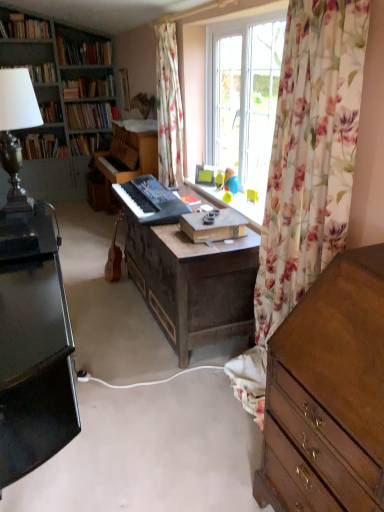
Describe the element at coordinates (328, 394) in the screenshot. The width and height of the screenshot is (384, 512). I see `wooden chest of drawers at right` at that location.

What is the approximate width of hardcover books at upper left, the 1th book viewed from the top?

The width of hardcover books at upper left, the 1th book viewed from the top, is 12.71 inches.

The image size is (384, 512). Identify the location of hardcover books at upper left, which appears as the fifth book when ordered from the bottom. (89, 87).

Find the location of a particular element. The image size is (384, 512). brown wooden guitar at center is located at coordinates point(114,256).

The height and width of the screenshot is (512, 384). In order to click on wooden chest of drawers at right in this screenshot , I will do `click(328, 394)`.

Is floral fabric curtain at center, the 1th curtain in the back-to-front sequence, behind black matte keyboard at center?

Yes, floral fabric curtain at center, the 1th curtain in the back-to-front sequence, is further from the viewer.

Which object is positioned more to the right, floral fabric curtain at center, the 1th curtain in the back-to-front sequence, or black matte keyboard at center?

From the viewer's perspective, floral fabric curtain at center, the 1th curtain in the back-to-front sequence, appears more on the right side.

From the picture: From the image's perspective, which object appears higher, floral fabric curtain at center, the 1th curtain in the back-to-front sequence, or black matte keyboard at center?

floral fabric curtain at center, the 1th curtain in the back-to-front sequence.

Considering the relative positions of hardcover books at upper left, arranged as the third book when viewed from the top, and metallic silver lampshade at upper left in the image provided, is hardcover books at upper left, arranged as the third book when viewed from the top, to the right of metallic silver lampshade at upper left from the viewer's perspective?

Incorrect, hardcover books at upper left, arranged as the third book when viewed from the top, is not on the right side of metallic silver lampshade at upper left.

Identify the location of the 5th book above when counting from the metallic silver lampshade at upper left (from the image's perspective). (89, 87).

Who is shorter, hardcover books at upper left, which appears as the fifth book when ordered from the bottom, or metallic silver lampshade at upper left?

hardcover books at upper left, which appears as the fifth book when ordered from the bottom.

Between hardcover book at left, arranged as the first book when ordered from the bottom, and hardcover books at upper left, arranged as the third book when viewed from the top, which one has less height?

hardcover books at upper left, arranged as the third book when viewed from the top.

Is hardcover book at left, arranged as the first book when ordered from the bottom, positioned beyond the bounds of hardcover books at upper left, which appears as the fifth book when ordered from the bottom?

That's correct, hardcover book at left, arranged as the first book when ordered from the bottom, is outside of hardcover books at upper left, which appears as the fifth book when ordered from the bottom.

From a real-world perspective, count 3rd books upward from the hardcover book at left, placed as the 7th book when sorted from top to bottom, and point to it. Please provide its 2D coordinates.

[(89, 87)]

Is the surface of hardcover book at left, placed as the 7th book when sorted from top to bottom, in direct contact with hardcover books at upper left, arranged as the third book when viewed from the top?

hardcover book at left, placed as the 7th book when sorted from top to bottom, and hardcover books at upper left, arranged as the third book when viewed from the top, are clearly separated.

Could you tell me if wooden desk at center is turned towards hardcover books at upper left, which ranks as the 2th book in top-to-bottom order?

No, wooden desk at center is not facing towards hardcover books at upper left, which ranks as the 2th book in top-to-bottom order.

Can you see wooden desk at center touching hardcover books at upper left, which ranks as the 2th book in top-to-bottom order?

No.

From a real-world perspective, between wooden desk at center and hardcover books at upper left, acting as the sixth book starting from the bottom, who is vertically higher?

In real-world perspective, hardcover books at upper left, acting as the sixth book starting from the bottom, is above.

Considering the relative sizes of wooden desk at center and hardcover books at upper left, acting as the sixth book starting from the bottom, in the image provided, is wooden desk at center taller than hardcover books at upper left, acting as the sixth book starting from the bottom,?

Indeed, wooden desk at center has a greater height compared to hardcover books at upper left, acting as the sixth book starting from the bottom.

Is black matte keyboard at center positioned far away from floral fabric curtain at right, placed as the second curtain when sorted from left to right?

No.

Does point (148, 211) appear closer or farther from the camera than point (315, 258)?

Clearly, point (148, 211) is more distant from the camera than point (315, 258).

In terms of height, does black matte keyboard at center look taller or shorter compared to floral fabric curtain at right, placed as the second curtain when sorted from left to right?

Considering their sizes, black matte keyboard at center has less height than floral fabric curtain at right, placed as the second curtain when sorted from left to right.

Is black matte keyboard at center bigger than floral fabric curtain at right, which is the first curtain from right to left?

Actually, black matte keyboard at center might be smaller than floral fabric curtain at right, which is the first curtain from right to left.

Who is shorter, hardcover book at left, arranged as the first book when ordered from the bottom, or wooden picture frame at upper center?

With less height is hardcover book at left, arranged as the first book when ordered from the bottom.

In the scene shown: From the image's perspective, between hardcover book at left, placed as the 7th book when sorted from top to bottom, and wooden picture frame at upper center, who is located below?

hardcover book at left, placed as the 7th book when sorted from top to bottom.

Is wooden picture frame at upper center at the back of hardcover book at left, placed as the 7th book when sorted from top to bottom?

No, wooden picture frame at upper center is not at the back of hardcover book at left, placed as the 7th book when sorted from top to bottom.

Which book is the 4th one when counting from the back of the wooden picture frame at upper center? Please provide its 2D coordinates.

[(41, 147)]

Is floral fabric curtain at right, the 1th curtain viewed from the front, turned away from hardcover book at center, which is the fourth book in bottom-to-top order?

That's not correct — floral fabric curtain at right, the 1th curtain viewed from the front, is not looking away from hardcover book at center, which is the fourth book in bottom-to-top order.

Based on the photo, from the image's perspective, which object appears higher, floral fabric curtain at right, which is counted as the second curtain, starting from the back, or hardcover book at center, which is the fourth book in bottom-to-top order?

hardcover book at center, which is the fourth book in bottom-to-top order, from the image's perspective.

Is floral fabric curtain at right, the 1th curtain viewed from the front, at the right side of hardcover book at center, which is the fourth book in bottom-to-top order?

Yes, floral fabric curtain at right, the 1th curtain viewed from the front, is to the right of hardcover book at center, which is the fourth book in bottom-to-top order.

Is point (333, 34) farther from camera compared to point (82, 105)?

No, (333, 34) is in front of (82, 105).

Locate an element on the screen. curtain above the black matte keyboard at center (from the image's perspective) is located at coordinates (168, 106).

Where is `the 1st book located above the metallic silver lampshade at upper left (from a real-world perspective)`? This screenshot has width=384, height=512. the 1st book located above the metallic silver lampshade at upper left (from a real-world perspective) is located at coordinates (89, 87).

Based on their spatial positions, is brown wooden guitar at center or wooden desk at center further from hardcover book at center, the 6th book viewed from the top?

Among the two, wooden desk at center is located further to hardcover book at center, the 6th book viewed from the top.

When comparing their distances from hardcover books at upper left, arranged as the third book when viewed from the top, does brown wooden guitar at center or wooden chest of drawers at right seem closer?

The object closer to hardcover books at upper left, arranged as the third book when viewed from the top, is brown wooden guitar at center.

Which object lies nearer to the anchor point floral fabric curtain at center, the 1th curtain in the back-to-front sequence, floral fabric curtain at right, which is counted as the second curtain, starting from the back, or hardcover book at center, which is the 2th book in bottom-to-top order?

floral fabric curtain at right, which is counted as the second curtain, starting from the back.

Estimate the real-world distances between objects in this image. Which object is further from brown wooden guitar at center, matte black lamp at upper left, which is counted as the fifth book, starting from the top, or wooden chest of drawers at right?

Among the two, matte black lamp at upper left, which is counted as the fifth book, starting from the top, is located further to brown wooden guitar at center.

Based on their spatial positions, is hardcover books at upper left, arranged as the third book when viewed from the top, or metallic silver lampshade at upper left closer to wooden chest of drawers at right?

metallic silver lampshade at upper left.

Looking at the image, which one is located closer to wooden bookcase at left, matte black lamp at upper left, the third book from the bottom, or floral fabric curtain at center, placed as the 1th curtain when sorted from left to right?

matte black lamp at upper left, the third book from the bottom.

When comparing their distances from floral fabric curtain at right, the 1th curtain viewed from the front, does wooden chest of drawers at right or hardcover book at left, arranged as the first book when ordered from the bottom, seem further?

The object further to floral fabric curtain at right, the 1th curtain viewed from the front, is hardcover book at left, arranged as the first book when ordered from the bottom.

Based on their spatial positions, is wooden picture frame at upper center or black matte keyboard at center further from matte black lamp at upper left, the third book from the bottom?

black matte keyboard at center is positioned further to the anchor matte black lamp at upper left, the third book from the bottom.

You are a GUI agent. You are given a task and a screenshot of the screen. Output one action in this format:
    pyautogui.click(x=<x>, y=<y>)
    Task: Click on the curtain between metallic silver lampshade at upper left and hardcover books at upper left, which appears as the seventh book when ordered from the bottom, along the z-axis
    This screenshot has width=384, height=512.
    Given the screenshot: What is the action you would take?
    pyautogui.click(x=168, y=106)

Where is `instrument between metallic silver lampshade at upper left and wooden bookcase at left from front to back`? instrument between metallic silver lampshade at upper left and wooden bookcase at left from front to back is located at coordinates (114, 256).

Where is `book between floral fabric curtain at center, which is the 2th curtain in front-to-back order, and hardcover books at upper left, acting as the sixth book starting from the bottom, in the front-back direction`? This screenshot has width=384, height=512. book between floral fabric curtain at center, which is the 2th curtain in front-to-back order, and hardcover books at upper left, acting as the sixth book starting from the bottom, in the front-back direction is located at coordinates (24, 27).

At what (x,y) coordinates should I click in order to perform the action: click on bookcase between floral fabric curtain at right, which is the first curtain from right to left, and wooden picture frame at upper center in the front-back direction. Please return your answer as a coordinate pair (x, y). The image size is (384, 512). Looking at the image, I should click on (61, 99).